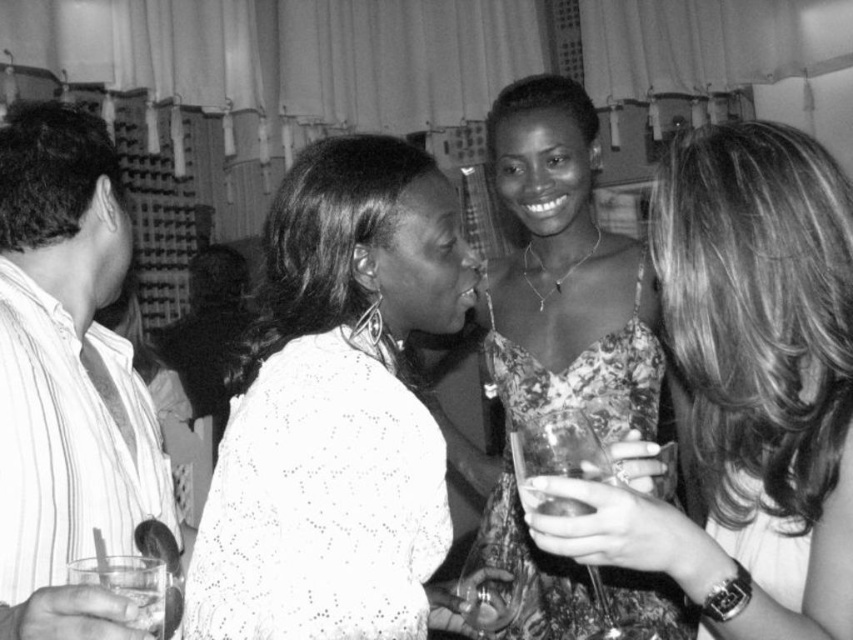
You are at a party and want to introduce yourself to the person in the striped cotton shirt at left. Where should you stand relative to the white lace dress at center?

The white lace dress at center is located below the striped cotton shirt at left, so to approach the striped cotton shirt at left, you should stand above the white lace dress at center.

You are a photographer at the event and want to take a photo of both the white lace dress at center and the striped cotton shirt at left. Which one should you focus on first to ensure they are both in sharp focus?

The white lace dress at center is closer to you than the striped cotton shirt at left, so focus on the white lace dress at center first to ensure both are in sharp focus.

You are at the center of the image. Where is the striped cotton shirt at left located in relation to your current position?

The striped cotton shirt at left is located at the lower left relative to your current position at the center of the image.